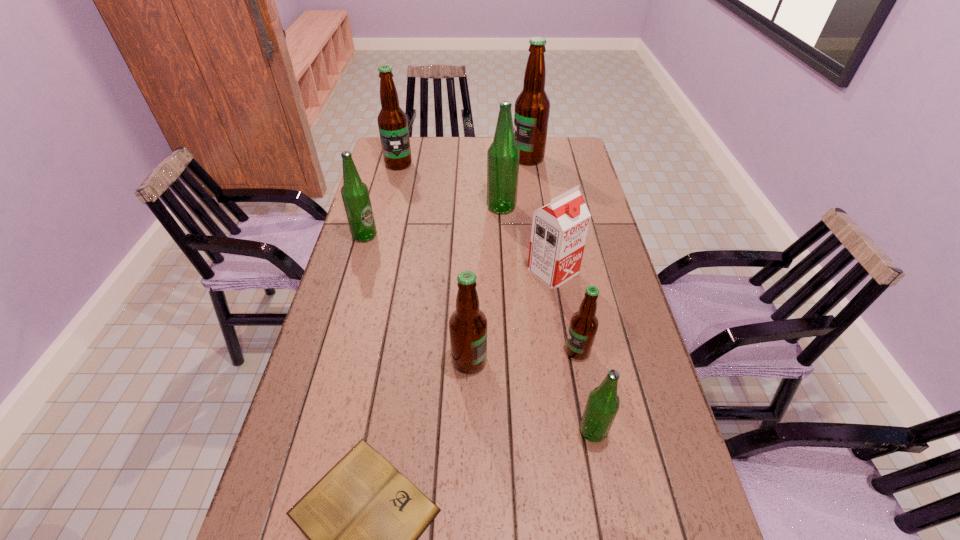
You are a GUI agent. You are given a task and a screenshot of the screen. Output one action in this format:
    pyautogui.click(x=<x>, y=<y>)
    Task: Click on the free space that satisfies the following two spatial constraints: 1. on the label of the tallest object; 2. on the label of the third smallest brown beer bottle
    
    Given the screenshot: What is the action you would take?
    pos(529,164)

Where is `free space that satisfies the following two spatial constraints: 1. on the label of the tallest beer bottle; 2. on the right side of the fifth nearest object`? Image resolution: width=960 pixels, height=540 pixels. free space that satisfies the following two spatial constraints: 1. on the label of the tallest beer bottle; 2. on the right side of the fifth nearest object is located at coordinates (545, 272).

Locate an element on the screen. vacant space that satisfies the following two spatial constraints: 1. on the label of the biggest brown beer bottle; 2. on the label of the leftmost brown beer bottle is located at coordinates (529, 164).